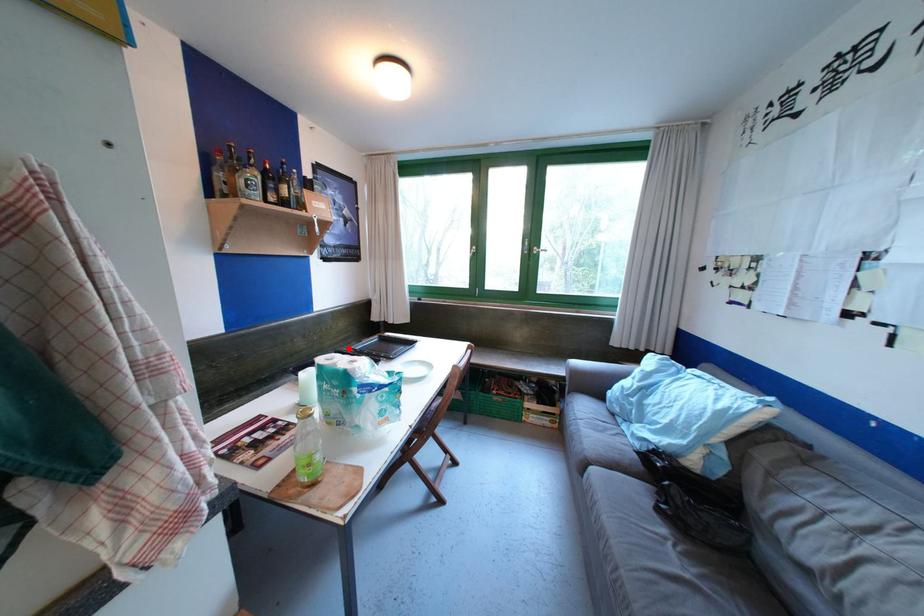
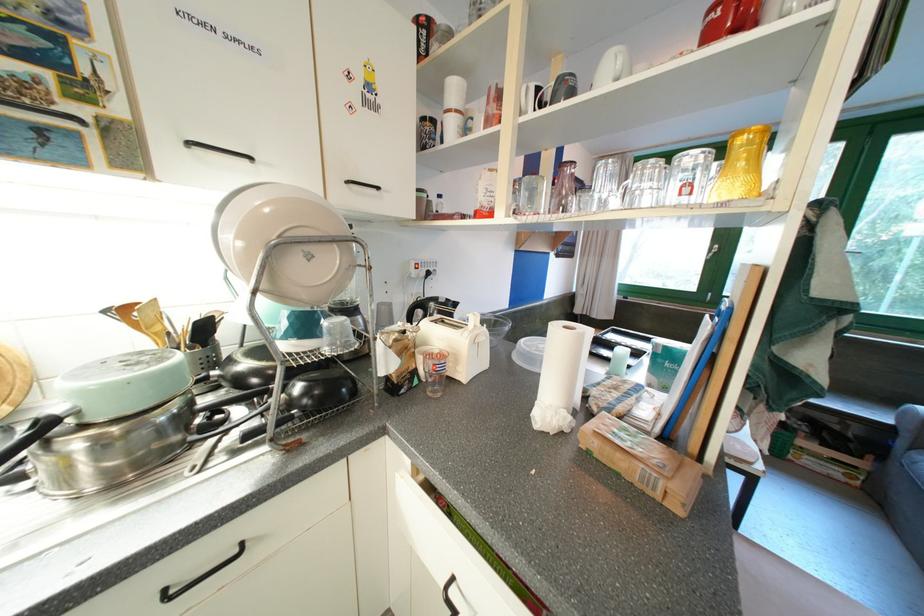
Question: I am providing you with two images of the same scene from different viewpoints. A red point is marked on the first image. At the location where the point appears in image 1, is it still visible in image 2?

Choices:
 (A) Yes
 (B) No

Answer: (B)